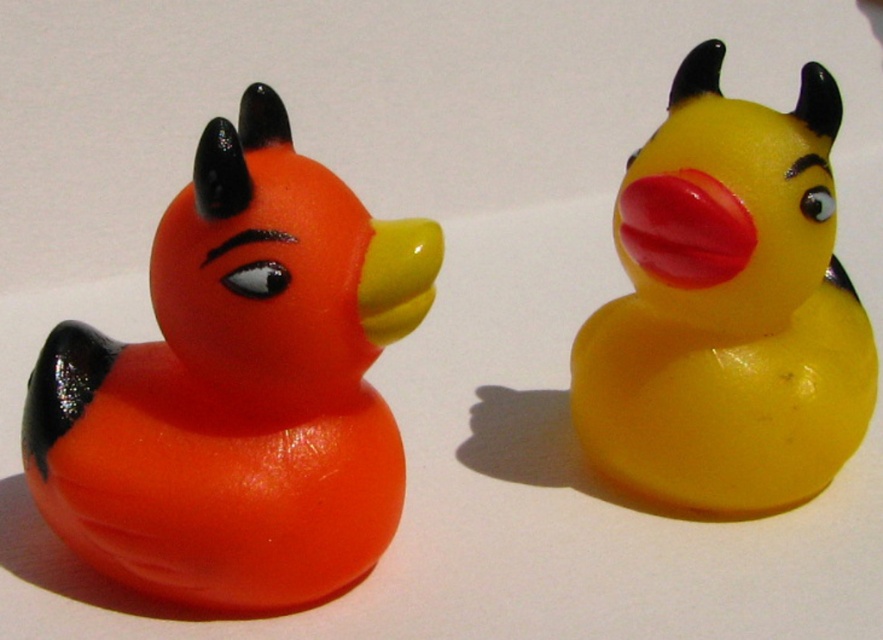
You are organizing a toy store shelf and need to arrange the yellow rubber duck at center and the rubber at right based on their sizes. Which duck should you place first if you want to arrange them from largest to smallest?

The yellow rubber duck at center should be placed first since it has a larger size compared to the rubber at right.

You have two rubber ducks in front of you. One is the yellow rubber duck at center and the other is the rubber at right. Which one is taller?

The yellow rubber duck at center is taller than the rubber at right.

You are a toy organizer who needs to place a new duck toy that is 4 inches wide between the yellow rubber duck at center and the rubber at right. Can you fit it there without moving the existing ducks?

The distance between the yellow rubber duck at center and the rubber at right is 3.54 inches, which is less than the 4 inches width of the new duck toy. Therefore, you cannot fit it there without moving the existing ducks.